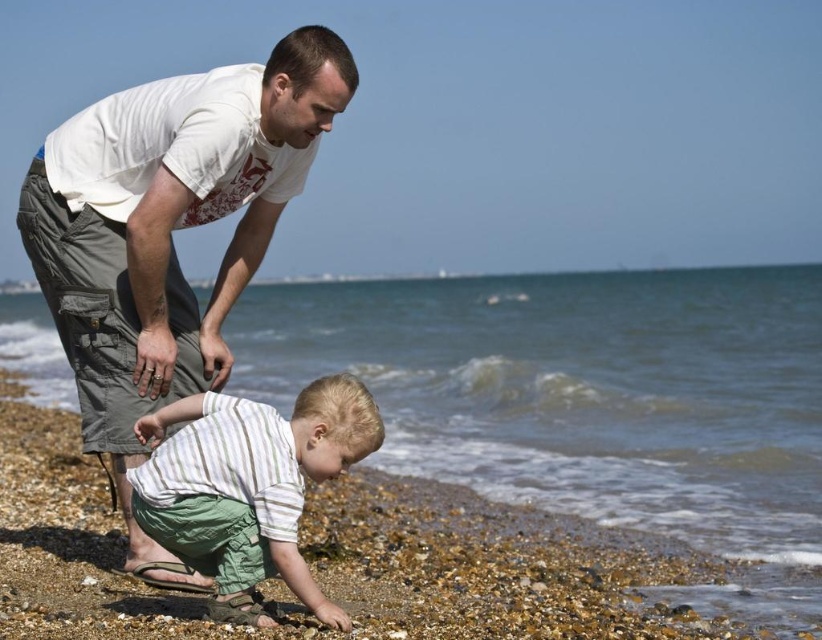
Is point (132, 589) positioned before point (262, 506)?

That is False.

In order to click on smooth pebbles at lower center in this screenshot , I will do `click(497, 566)`.

Is smooth pebbles at lower center shorter than white cotton t-shirt at upper left?

Yes.

Does point (612, 538) come behind point (169, 177)?

Yes.

Is point (3, 385) positioned behind point (35, 179)?

Yes, it is behind point (35, 179).

I want to click on smooth pebbles at lower center, so click(x=497, y=566).

Can you confirm if white cotton t-shirt at upper left is shorter than striped cotton shirt at lower center?

No.

Locate an element on the screen. white cotton t-shirt at upper left is located at coordinates (167, 234).